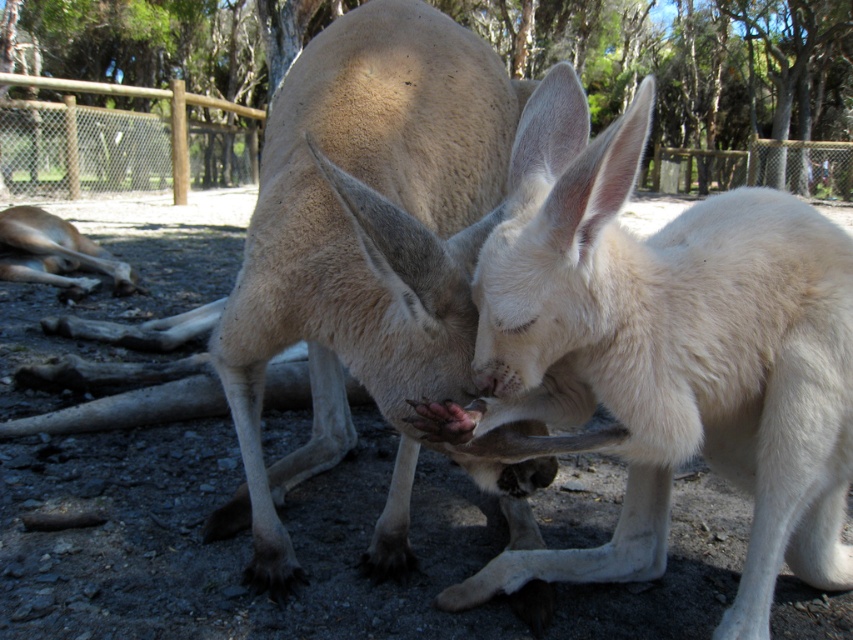
You are a zookeeper observing the kangaroos in their enclosure. You notice the light brown fur at center and the wooden fence at upper left. Which object takes up more space in the image?

The light brown fur at center is bigger than the wooden fence at upper left, so it takes up more space in the image.

You are a zookeeper trying to separate two kangaroos for a health check. The white fur kangaroo at center and the light brown fur at center are currently close. What is the minimum distance you need to maintain between them to ensure they can still interact without physical contact?

The white fur kangaroo at center and the light brown fur at center are 13.90 inches apart from each other. To ensure they can still interact without physical contact, the minimum distance should be slightly more than 13.90 inches, so maintaining at least 14 inches would be appropriate.

You are a zookeeper observing the kangaroos in their enclosure. You notice the white fur kangaroo at center and the light brown fur at center. Which kangaroo is closer to you, the observer?

The white fur kangaroo at center is closer to you because it is in front of the light brown fur at center.